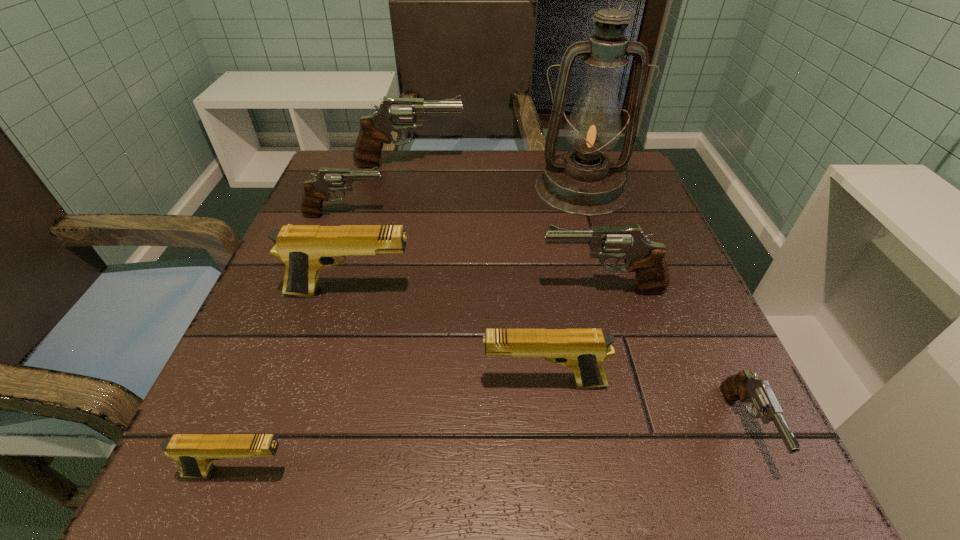
Locate an element on the screen. The width and height of the screenshot is (960, 540). free space that is in between the second smallest gray pistol and the rightmost tan pistol is located at coordinates point(444,299).

You are a GUI agent. You are given a task and a screenshot of the screen. Output one action in this format:
    pyautogui.click(x=<x>, y=<y>)
    Task: Click on the free space between the tallest object and the second biggest tan pistol
    The height and width of the screenshot is (540, 960).
    Given the screenshot: What is the action you would take?
    pyautogui.click(x=563, y=286)

Find the location of a particular element. The height and width of the screenshot is (540, 960). object that ranks as the sixth closest to the third gray pistol from left to right is located at coordinates (394, 114).

Select which object appears as the fifth closest to the tallest pistol. Please provide its 2D coordinates. Your answer should be formatted as a tuple, i.e. [(x, y)], where the tuple contains the x and y coordinates of a point satisfying the conditions above.

[(583, 350)]

Locate which pistol ranks third in proximity to the nearest gray pistol. Please provide its 2D coordinates. Your answer should be formatted as a tuple, i.e. [(x, y)], where the tuple contains the x and y coordinates of a point satisfying the conditions above.

[(304, 249)]

I want to click on pistol identified as the third closest to the rightmost object, so click(304, 249).

Locate an element on the screen. The image size is (960, 540). gray pistol that is the closest to the third biggest gray pistol is located at coordinates (394, 114).

Point out which gray pistol is positioned as the second nearest to the second farthest pistol. Please provide its 2D coordinates. Your answer should be formatted as a tuple, i.e. [(x, y)], where the tuple contains the x and y coordinates of a point satisfying the conditions above.

[(646, 258)]

Identify the location of tan pistol that is the third nearest to the nearest gray pistol. The height and width of the screenshot is (540, 960). (195, 453).

Point out which tan pistol is positioned as the nearest to the farthest pistol. Please provide its 2D coordinates. Your answer should be formatted as a tuple, i.e. [(x, y)], where the tuple contains the x and y coordinates of a point satisfying the conditions above.

[(304, 249)]